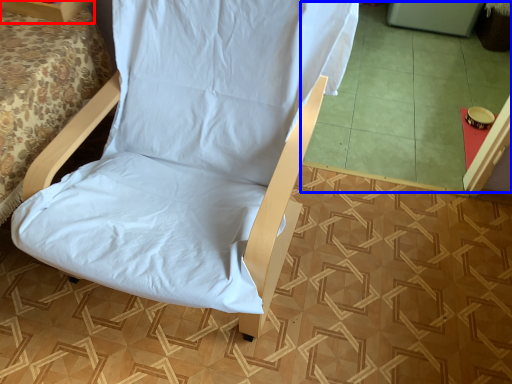
Question: Which object is closer to the camera taking this photo, furniture (highlighted by a red box) or tile (highlighted by a blue box)?

Choices:
 (A) furniture
 (B) tile

Answer: (A)